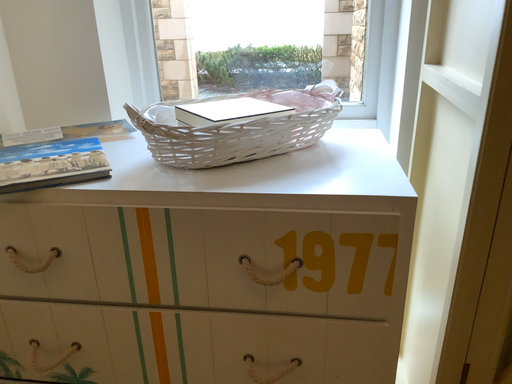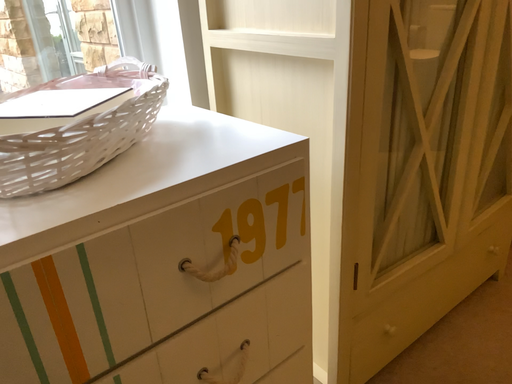
Question: Which way did the camera rotate in the video?

Choices:
 (A) rotated right
 (B) rotated left

Answer: (A)